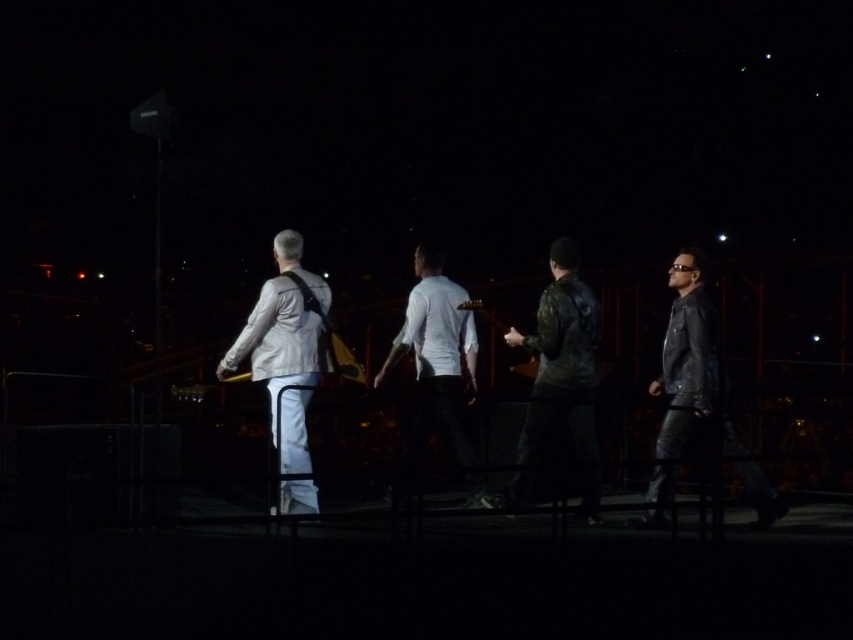
Question: Is leather jacket at right in front of light gray fabric jacket at left?

Choices:
 (A) no
 (B) yes

Answer: (B)

Question: Considering the real-world distances, which object is farthest from the leather jacket at right?

Choices:
 (A) light gray fabric jacket at left
 (B) leather jacket at center
 (C) white matte shirt at center

Answer: (A)

Question: Is leather jacket at right to the left of light gray fabric jacket at left from the viewer's perspective?

Choices:
 (A) no
 (B) yes

Answer: (A)

Question: Among these points, which one is farthest from the camera?

Choices:
 (A) (289, 404)
 (B) (505, 497)
 (C) (682, 275)
 (D) (450, 410)

Answer: (D)

Question: Is leather jacket at center closer to the viewer compared to light gray fabric jacket at left?

Choices:
 (A) no
 (B) yes

Answer: (B)

Question: Which point is closer to the camera?

Choices:
 (A) (409, 301)
 (B) (538, 445)
 (C) (259, 308)
 (D) (703, 401)

Answer: (D)